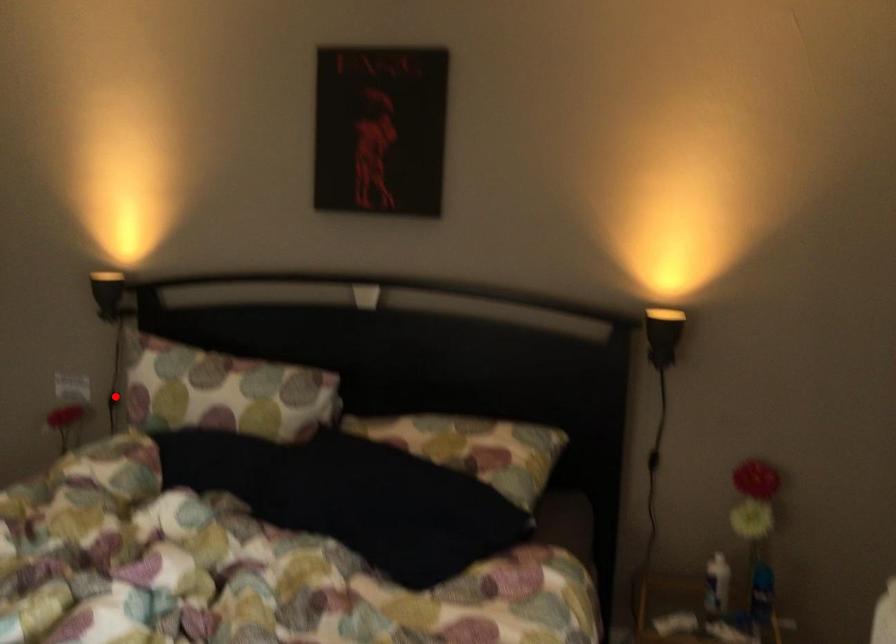
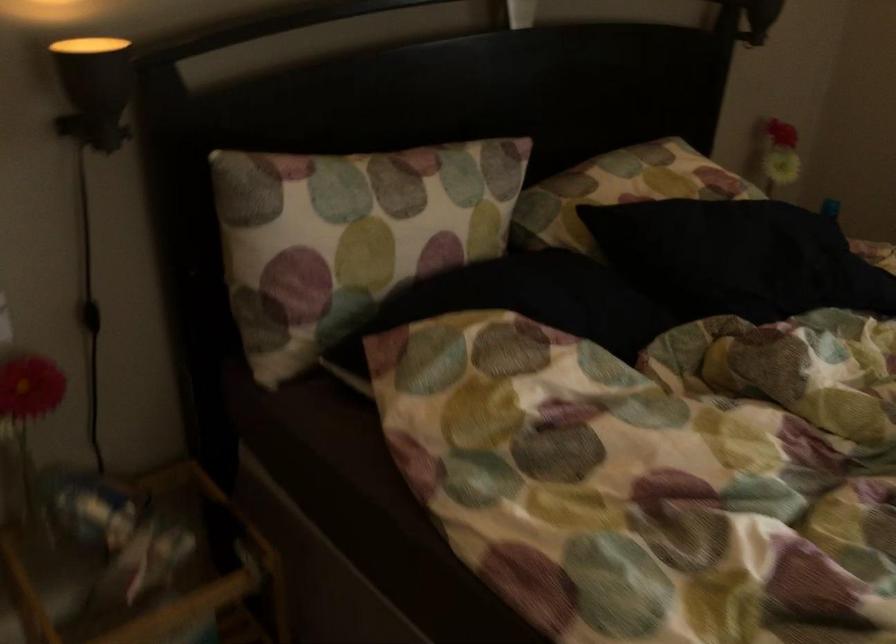
Question: A red point is marked in image1. In image2, is the corresponding 3D point closer to the camera or farther? Reply with the corresponding letter.

Choices:
 (A) The corresponding 3D point is closer.
 (B) The corresponding 3D point is farther.

Answer: (A)